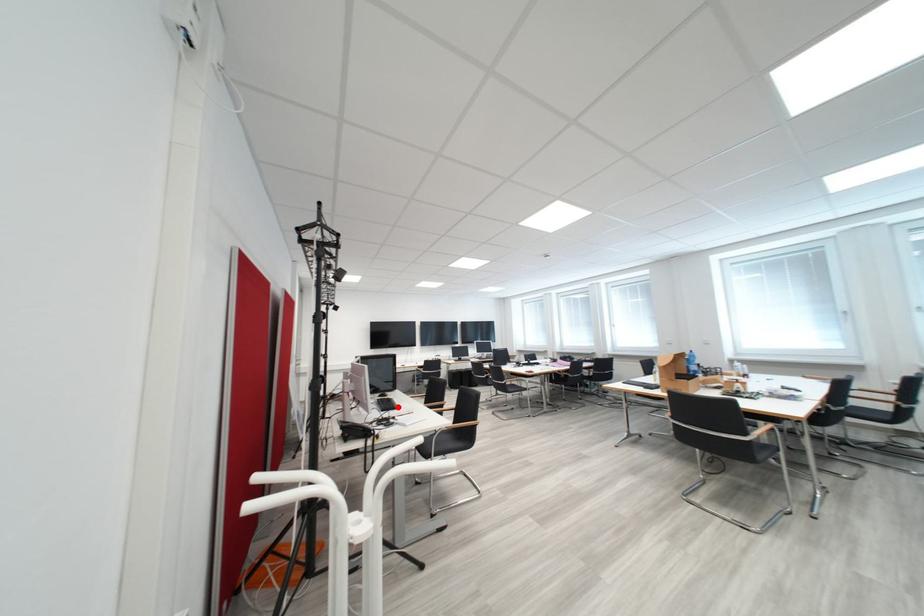
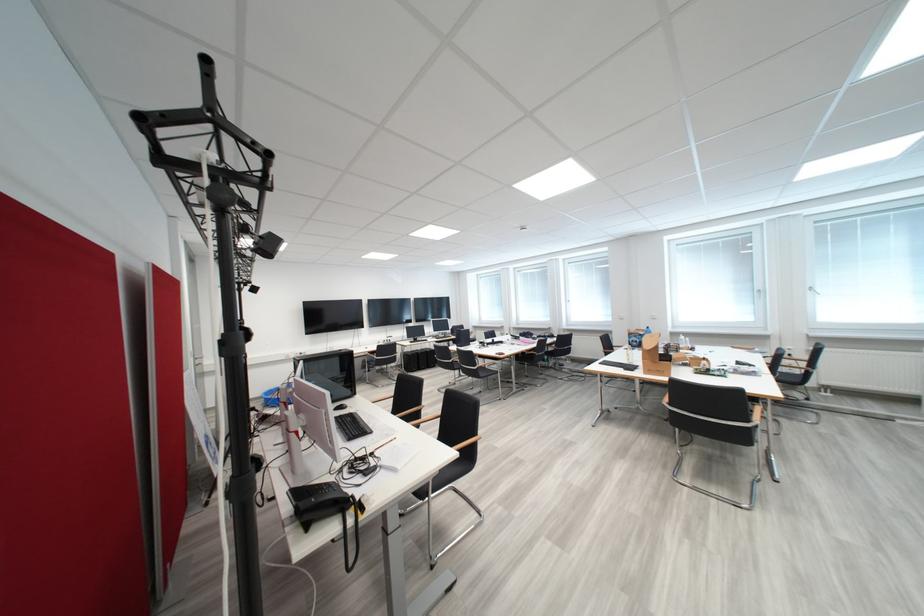
Question: I am providing you with two images of the same scene from different viewpoints. A red point is marked on the first image. Can you still see the location of the red point in image 2?

Choices:
 (A) Yes
 (B) No

Answer: (A)